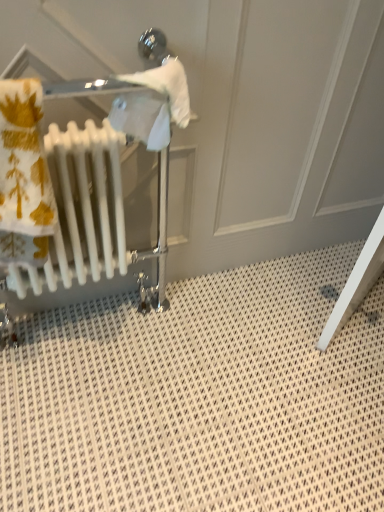
Question: Is the position of white glossy radiator at left less distant than that of white plastic radiator at left?

Choices:
 (A) no
 (B) yes

Answer: (A)

Question: From a real-world perspective, is white glossy radiator at left positioned under white plastic radiator at left based on gravity?

Choices:
 (A) no
 (B) yes

Answer: (B)

Question: From a real-world perspective, is white glossy radiator at left on top of white plastic radiator at left?

Choices:
 (A) yes
 (B) no

Answer: (B)

Question: Is white glossy radiator at left shorter than white plastic radiator at left?

Choices:
 (A) yes
 (B) no

Answer: (B)

Question: Could you tell me if white glossy radiator at left is turned towards white plastic radiator at left?

Choices:
 (A) yes
 (B) no

Answer: (A)

Question: Can you confirm if white glossy radiator at left is bigger than white plastic radiator at left?

Choices:
 (A) no
 (B) yes

Answer: (B)

Question: Is white plastic radiator at left beside white glossy radiator at left?

Choices:
 (A) no
 (B) yes

Answer: (B)

Question: Considering the relative positions of white plastic radiator at left and white glossy radiator at left in the image provided, is white plastic radiator at left to the right of white glossy radiator at left from the viewer's perspective?

Choices:
 (A) no
 (B) yes

Answer: (A)

Question: Is white plastic radiator at left positioned far away from white glossy radiator at left?

Choices:
 (A) no
 (B) yes

Answer: (A)

Question: Could you tell me if white plastic radiator at left is turned towards white glossy radiator at left?

Choices:
 (A) no
 (B) yes

Answer: (A)

Question: Considering the relative sizes of white plastic radiator at left and white glossy radiator at left in the image provided, is white plastic radiator at left wider than white glossy radiator at left?

Choices:
 (A) yes
 (B) no

Answer: (B)

Question: Is white plastic radiator at left behind white glossy radiator at left?

Choices:
 (A) yes
 (B) no

Answer: (B)

Question: From a real-world perspective, relative to white plastic radiator at left, is white glossy radiator at left vertically above or below?

Choices:
 (A) below
 (B) above

Answer: (A)